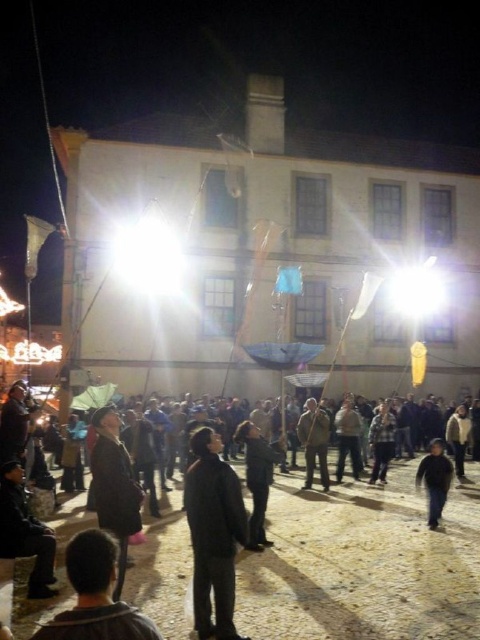
Locate an element on the screen. This screenshot has width=480, height=640. dark gray fabric jacket at center is located at coordinates [x=257, y=477].

Can you confirm if dark gray fabric jacket at center is thinner than dark gray fabric at center?

In fact, dark gray fabric jacket at center might be wider than dark gray fabric at center.

Is point (268, 465) more distant than point (314, 413)?

No, (268, 465) is closer to viewer.

Locate an element on the screen. The image size is (480, 640). dark gray fabric jacket at center is located at coordinates (257, 477).

Does dark gray fabric at center have a larger size compared to dark blue jeans at lower right?

No.

How far apart are dark gray fabric at center and dark blue jeans at lower right?

They are 8.92 meters apart.

Does point (315, 428) come closer to viewer compared to point (424, 476)?

No, (315, 428) is further to viewer.

Locate an element on the screen. dark gray fabric at center is located at coordinates (314, 442).

Who is lower down, black matte jacket at center or dark gray fabric jacket at center?

Positioned lower is dark gray fabric jacket at center.

Is point (207, 477) closer to camera compared to point (242, 420)?

Yes, it is.

Identify the location of black matte jacket at center. This screenshot has width=480, height=640. (214, 532).